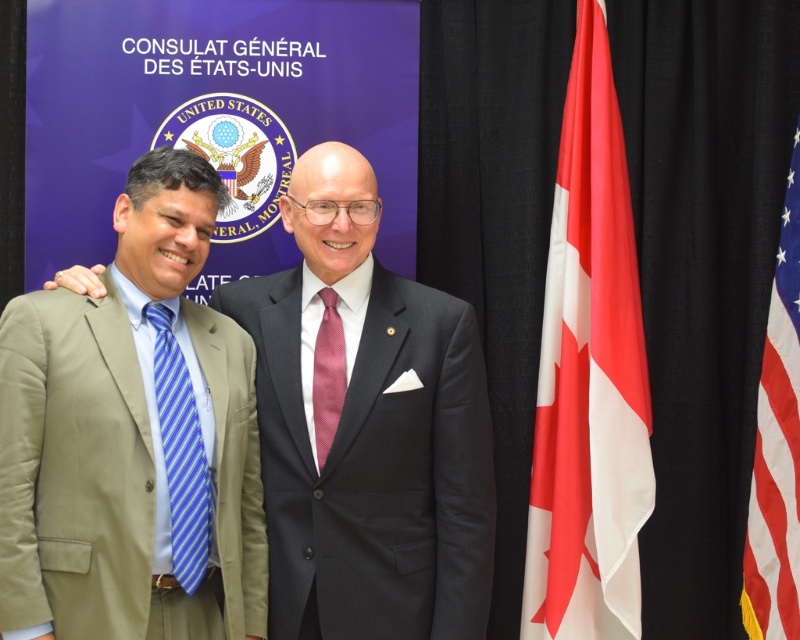
You are a fashion designer who needs to create a matching accessory for the khaki cotton suit at left and the purple textured tie at center. Given their proximity, what should the accessory measure to ensure it complements both without being too far?

The khaki cotton suit at left is 8.06 inches from the purple textured tie at center. To ensure the accessory complements both without being too far, it should be placed within this distance, ideally around 4 to 6 inches from each object.